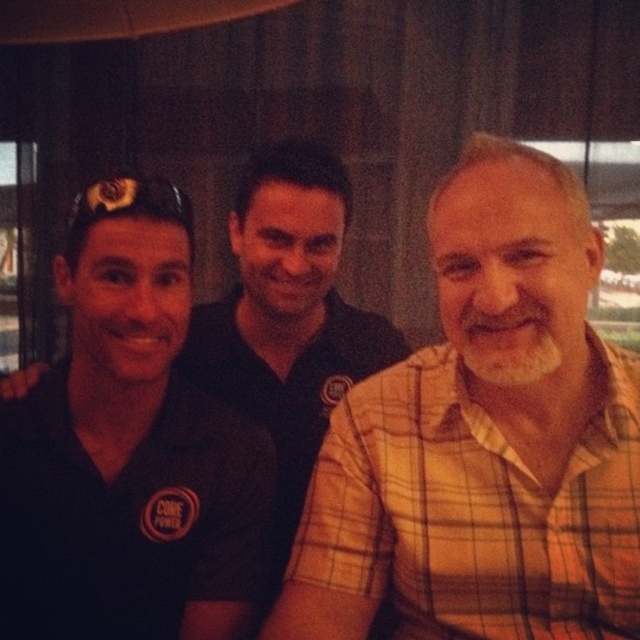
What do you see at coordinates (484, 440) in the screenshot? I see `plaid cotton shirt at center` at bounding box center [484, 440].

Which of these two, plaid cotton shirt at center or black matte shirt at center, stands shorter?

Standing shorter between the two is plaid cotton shirt at center.

Where is `plaid cotton shirt at center`? This screenshot has width=640, height=640. plaid cotton shirt at center is located at coordinates (484, 440).